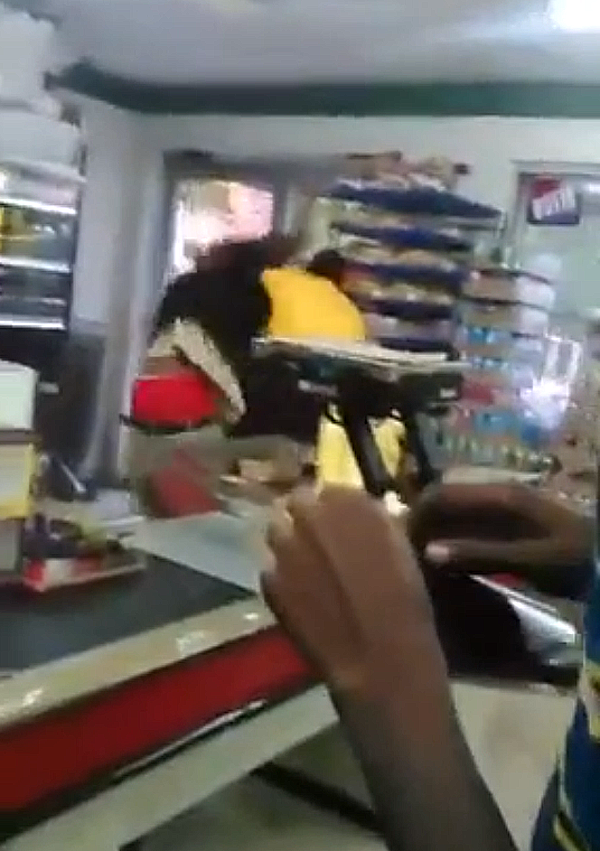
This screenshot has height=851, width=600. I want to click on black mat to left of hand, so click(69, 614).